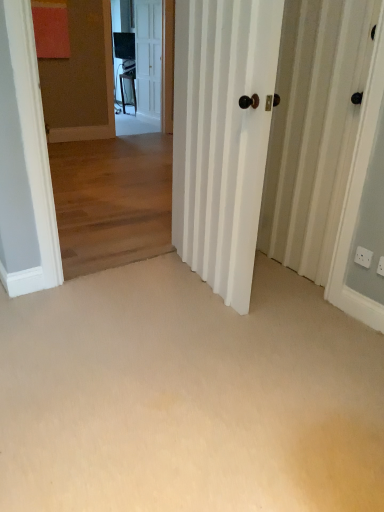
The width and height of the screenshot is (384, 512). Identify the location of vacant position to the left of wooden floor at center, the 1th corridor when ordered from top to bottom. (90, 261).